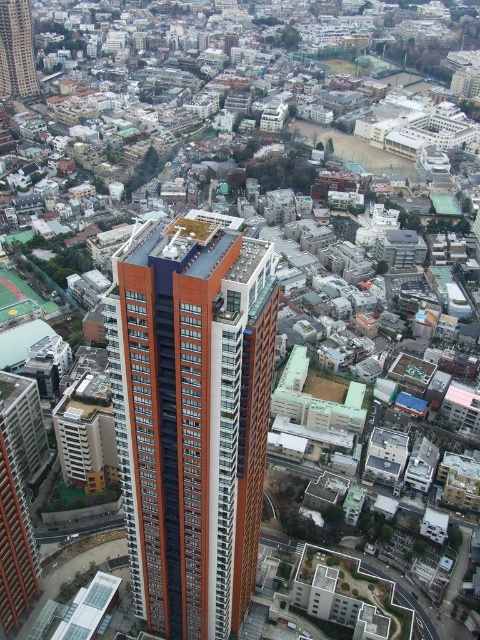
Does orange glassy building at center have a larger size compared to orange glass tower at center?

Correct, orange glassy building at center is larger in size than orange glass tower at center.

Is point (216, 497) positioned behind point (29, 10)?

No, it is in front of (29, 10).

Between point (139, 291) and point (0, 86), which one is positioned behind?

Point (0, 86)

Where is `orange glassy building at center`? orange glassy building at center is located at coordinates (192, 417).